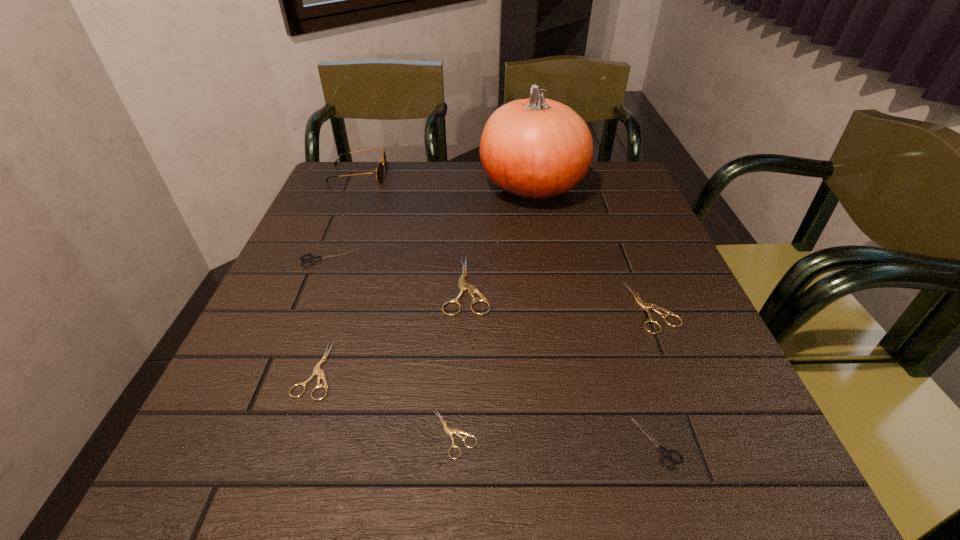
The height and width of the screenshot is (540, 960). I want to click on the tallest object, so (x=536, y=149).

Identify the location of pumpkin. (536, 149).

The image size is (960, 540). Find the location of `black sunglasses`. black sunglasses is located at coordinates (379, 170).

This screenshot has height=540, width=960. What are the coordinates of `sunglasses` in the screenshot? It's located at (379, 170).

I want to click on the biggest beige shears, so click(463, 285).

Find the location of `the bigger black shears`. the bigger black shears is located at coordinates (312, 259).

Where is `the farther black shears`? the farther black shears is located at coordinates (312, 259).

Identify the location of the rightmost beige shears. (643, 305).

Where is `the third nearest shears`? This screenshot has height=540, width=960. the third nearest shears is located at coordinates (317, 370).

The width and height of the screenshot is (960, 540). What are the coordinates of `the sixth farthest object` in the screenshot? It's located at (317, 370).